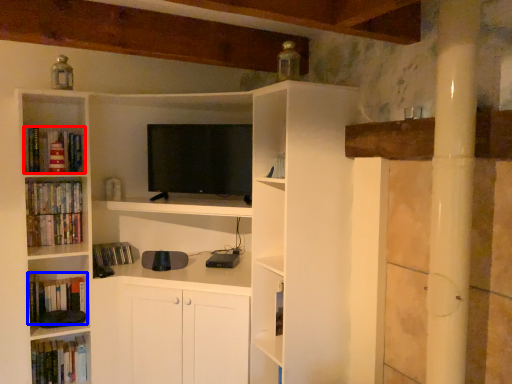
Question: Which object is closer to the camera taking this photo, book (highlighted by a red box) or book (highlighted by a blue box)?

Choices:
 (A) book
 (B) book

Answer: (A)